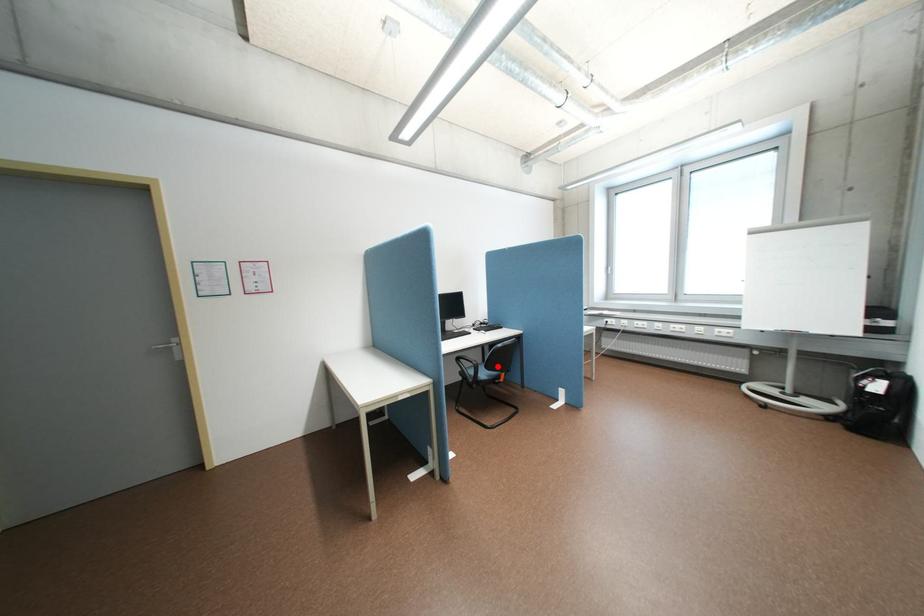
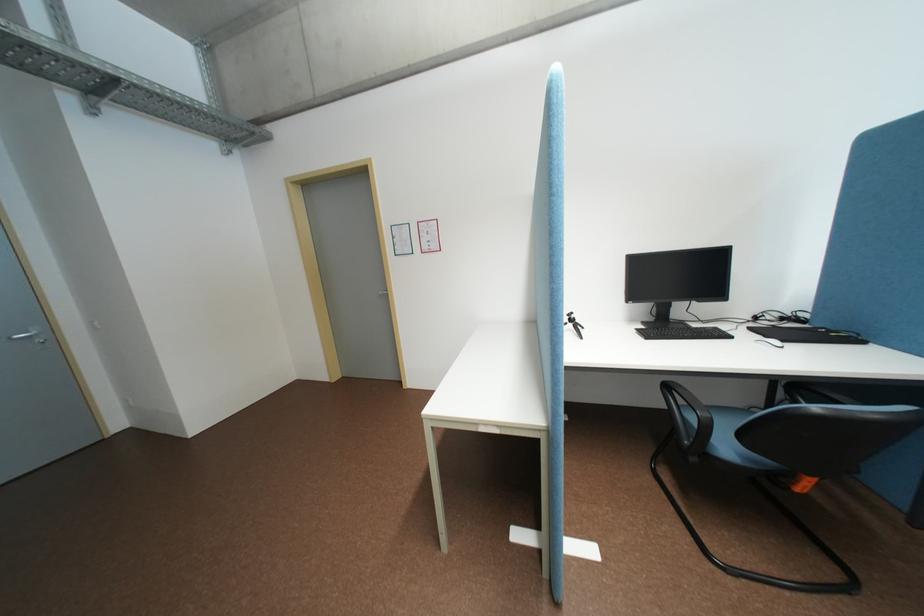
Where in the second image is the point corresponding to the highlighted location from the first image?

(755, 437)